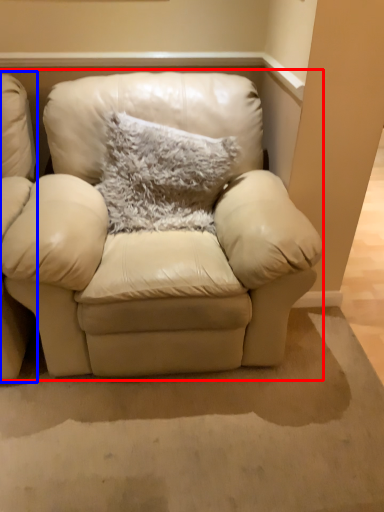
Question: Which point is further to the camera, studio couch (highlighted by a red box) or chair (highlighted by a blue box)?

Choices:
 (A) studio couch
 (B) chair

Answer: (A)